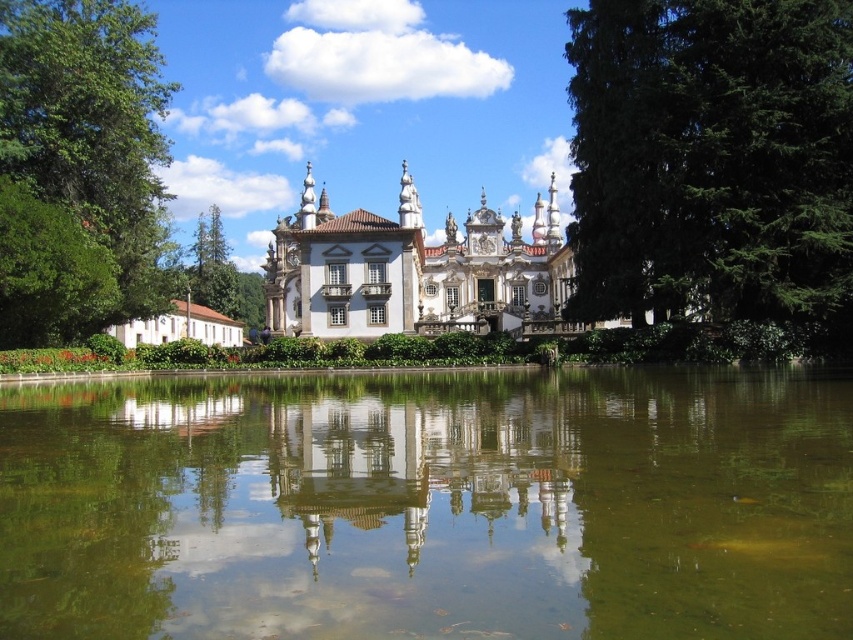
You are an architect visiting the site of a new project. You see the green reflective water at center and the white ornate palace at center. Which one appears larger in the image?

The white ornate palace at center is larger than the green reflective water at center.

You are standing in front of the grand building and want to take a photo of the transparent glass reflection at center without the green textured tree at right blocking it. How should you adjust your position?

Move to the left side of the green textured tree at right so that the transparent glass reflection at center becomes visible without obstruction from the tree.

You are standing on the edge of the green reflective water at center looking up at the white ornate palace at center. Which direction should you face to see the palace reflected in the water?

The green reflective water at center is located below the white ornate palace at center, so facing upward toward the palace would allow you to see its reflection in the water below.